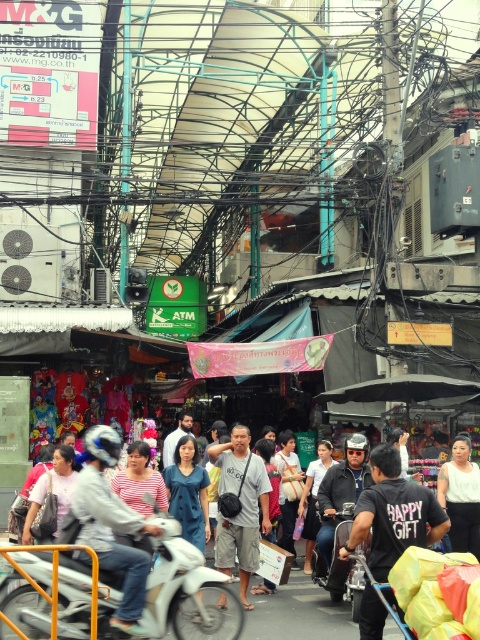
Between point (195, 556) and point (399, 550), which one is positioned in front?

Point (399, 550) is in front.

What do you see at coordinates (111, 568) in the screenshot?
I see `dark blue shirt at center` at bounding box center [111, 568].

Find the location of a particular element. The image size is (480, 640). dark blue shirt at center is located at coordinates (111, 568).

Is point (359, 490) farther from viewer compared to point (460, 497)?

No.

Can you confirm if matte black helmet at center is shorter than white matte shirt at center?

Incorrect, matte black helmet at center's height does not fall short of white matte shirt at center's.

Measure the distance between matte black helmet at center and camera.

16.98 meters

The height and width of the screenshot is (640, 480). What are the coordinates of `matte black helmet at center` in the screenshot? It's located at (338, 512).

Who is shorter, dark blue shirt at center or white matte motorcycle at center?

white matte motorcycle at center is shorter.

Is dark blue shirt at center smaller than white matte motorcycle at center?

No.

Is point (73, 621) positioned after point (72, 589)?

No.

I want to click on dark blue shirt at center, so click(111, 568).